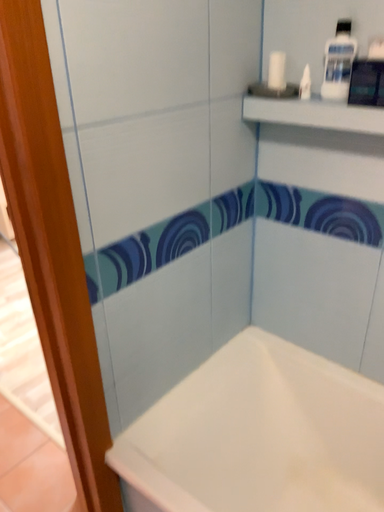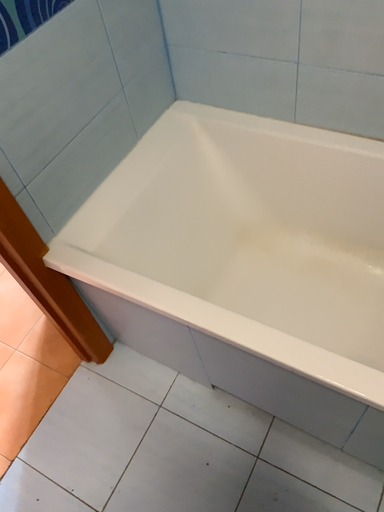
Question: Which way did the camera rotate in the video?

Choices:
 (A) rotated right
 (B) rotated left

Answer: (A)